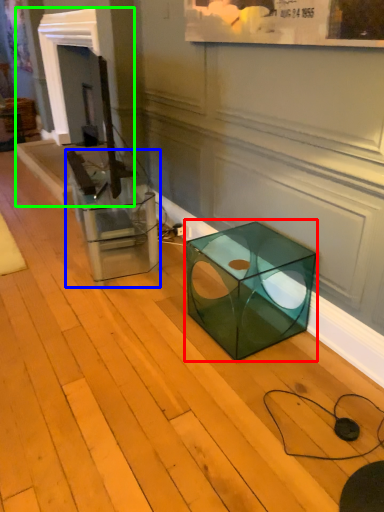
Question: Which object is positioned farthest from table (highlighted by a red box)? Select from glass box (highlighted by a blue box) and fireplace (highlighted by a green box).

Choices:
 (A) glass box
 (B) fireplace

Answer: (B)